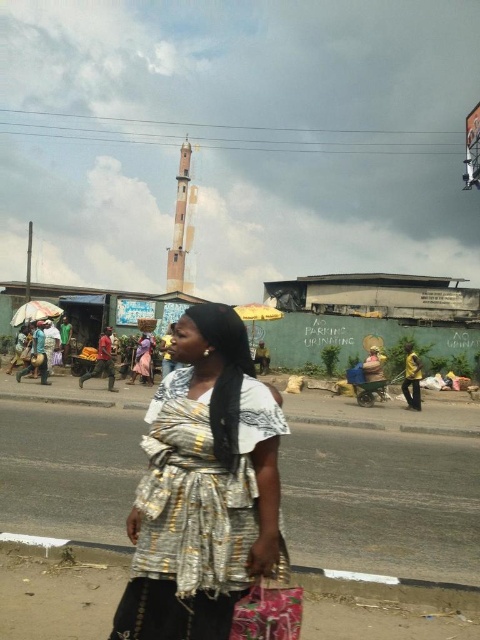
Question: Which of the following is the closest to the observer?

Choices:
 (A) yellow fabric at right
 (B) silver metallic dress at center
 (C) floral fabric bag at lower center

Answer: (C)

Question: Which point is closer to the camera taking this photo?

Choices:
 (A) (255, 611)
 (B) (418, 356)
 (C) (263, 570)

Answer: (A)

Question: Considering the real-world distances, which object is farthest from the floral fabric bag at lower center?

Choices:
 (A) silver metallic dress at center
 (B) yellow fabric at right

Answer: (B)

Question: Does silver metallic dress at center lie in front of floral fabric bag at lower center?

Choices:
 (A) no
 (B) yes

Answer: (A)

Question: Is silver metallic dress at center to the right of yellow fabric at right from the viewer's perspective?

Choices:
 (A) yes
 (B) no

Answer: (B)

Question: Does silver metallic dress at center have a smaller size compared to floral fabric bag at lower center?

Choices:
 (A) no
 (B) yes

Answer: (A)